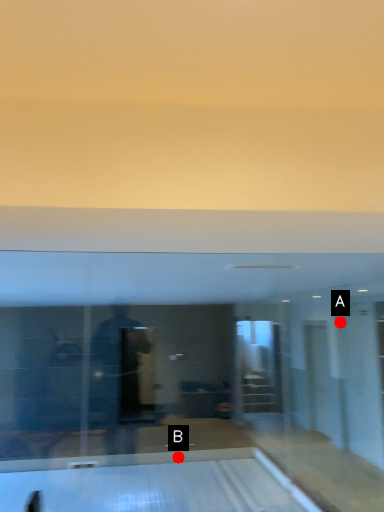
Question: Two points are circled on the image, labeled by A and B beside each circle. Which point appears closest to the camera in this image?

Choices:
 (A) A is closer
 (B) B is closer

Answer: (B)